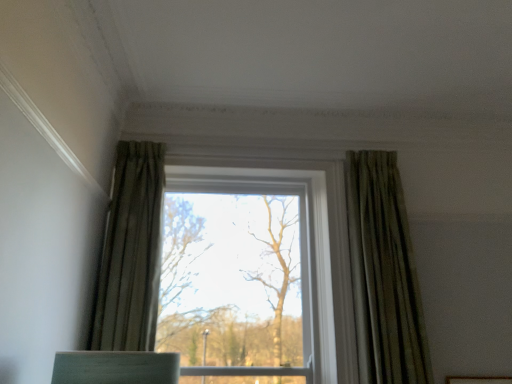
Question: Based on their positions, is green textured curtain at right, which is the second curtain in left-to-right order, located to the left or right of clear glass window at center?

Choices:
 (A) right
 (B) left

Answer: (A)

Question: Is point (382, 195) positioned closer to the camera than point (390, 360)?

Choices:
 (A) farther
 (B) closer

Answer: (A)

Question: Which of these objects is positioned farthest from the green textured curtain at left, which is the second curtain from right to left?

Choices:
 (A) clear glass window at center
 (B) green textured curtain at right, which is the second curtain in left-to-right order

Answer: (B)

Question: Estimate the real-world distances between objects in this image. Which object is closer to the green textured curtain at right, which ranks as the 1th curtain in right-to-left order?

Choices:
 (A) clear glass window at center
 (B) green textured curtain at left, which is the second curtain from right to left

Answer: (A)